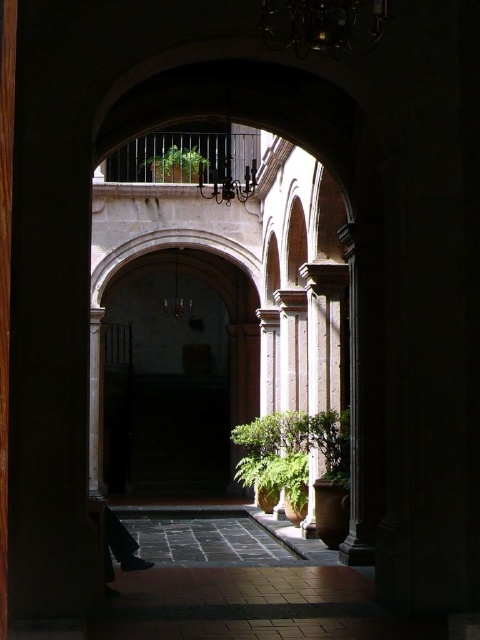
How far apart are green leafy plant at lower center and green leafy plant at center?

green leafy plant at lower center and green leafy plant at center are 81.11 centimeters apart.

Does green leafy plant at lower center have a larger size compared to green leafy plant at center?

Correct, green leafy plant at lower center is larger in size than green leafy plant at center.

Describe the element at coordinates (291, 451) in the screenshot. I see `green leafy plant at lower center` at that location.

In order to click on green leafy plant at lower center in this screenshot , I will do `click(291, 451)`.

Does smooth stone archway at center appear on the left side of green leafy plant at upper center?

Yes, smooth stone archway at center is to the left of green leafy plant at upper center.

Is point (217, 282) in front of point (147, 168)?

No, (217, 282) is further to viewer.

Locate an element on the screen. This screenshot has width=480, height=640. smooth stone archway at center is located at coordinates (175, 372).

Locate an element on the screen. Image resolution: width=480 pixels, height=640 pixels. smooth stone archway at center is located at coordinates (175, 372).

Is smooth stone archway at center taller than green leafy plant at lower center?

Indeed, smooth stone archway at center has a greater height compared to green leafy plant at lower center.

Who is taller, smooth stone archway at center or green leafy plant at lower center?

With more height is smooth stone archway at center.

Consider the image. Measure the distance between point (x=113, y=360) and camera.

Point (x=113, y=360) is 268.06 feet from camera.

Identify the location of smooth stone archway at center. The height and width of the screenshot is (640, 480). (175, 372).